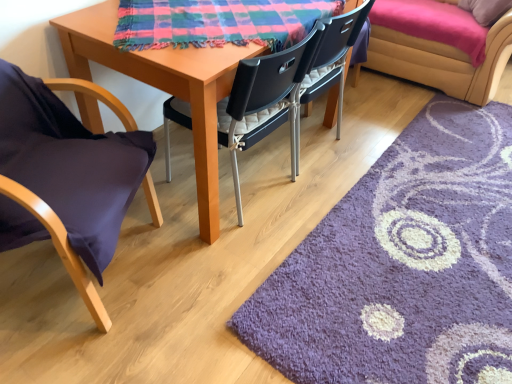
Question: From the image's perspective, is velvet yellow couch at upper right over purple shaggy rug at lower right?

Choices:
 (A) yes
 (B) no

Answer: (A)

Question: Could you tell me if velvet yellow couch at upper right is facing purple shaggy rug at lower right?

Choices:
 (A) no
 (B) yes

Answer: (B)

Question: From a real-world perspective, is velvet yellow couch at upper right positioned under purple shaggy rug at lower right based on gravity?

Choices:
 (A) yes
 (B) no

Answer: (B)

Question: Is velvet yellow couch at upper right to the left of purple shaggy rug at lower right from the viewer's perspective?

Choices:
 (A) no
 (B) yes

Answer: (A)

Question: Is velvet yellow couch at upper right with purple shaggy rug at lower right?

Choices:
 (A) yes
 (B) no

Answer: (B)

Question: Visually, is plaid fabric at center positioned to the left or to the right of velvet yellow couch at upper right?

Choices:
 (A) left
 (B) right

Answer: (A)

Question: Considering the positions of plaid fabric at center and velvet yellow couch at upper right in the image, is plaid fabric at center wider or thinner than velvet yellow couch at upper right?

Choices:
 (A) wide
 (B) thin

Answer: (B)

Question: Is plaid fabric at center inside or outside of velvet yellow couch at upper right?

Choices:
 (A) outside
 (B) inside

Answer: (A)

Question: From a real-world perspective, is plaid fabric at center positioned above or below velvet yellow couch at upper right?

Choices:
 (A) above
 (B) below

Answer: (A)

Question: In terms of height, does purple shaggy rug at lower right look taller or shorter compared to black plastic chair at center, acting as the first chair starting from the right?

Choices:
 (A) short
 (B) tall

Answer: (A)

Question: Is purple shaggy rug at lower right wider or thinner than black plastic chair at center, acting as the first chair starting from the right?

Choices:
 (A) thin
 (B) wide

Answer: (B)

Question: Is purple shaggy rug at lower right inside or outside of black plastic chair at center, acting as the first chair starting from the right?

Choices:
 (A) outside
 (B) inside

Answer: (A)

Question: From a real-world perspective, is purple shaggy rug at lower right above or below black plastic chair at center, acting as the second chair starting from the left?

Choices:
 (A) above
 (B) below

Answer: (B)

Question: Considering the positions of purple shaggy rug at lower right and velvet yellow couch at upper right in the image, is purple shaggy rug at lower right taller or shorter than velvet yellow couch at upper right?

Choices:
 (A) short
 (B) tall

Answer: (A)

Question: From the image's perspective, is purple shaggy rug at lower right above or below velvet yellow couch at upper right?

Choices:
 (A) below
 (B) above

Answer: (A)